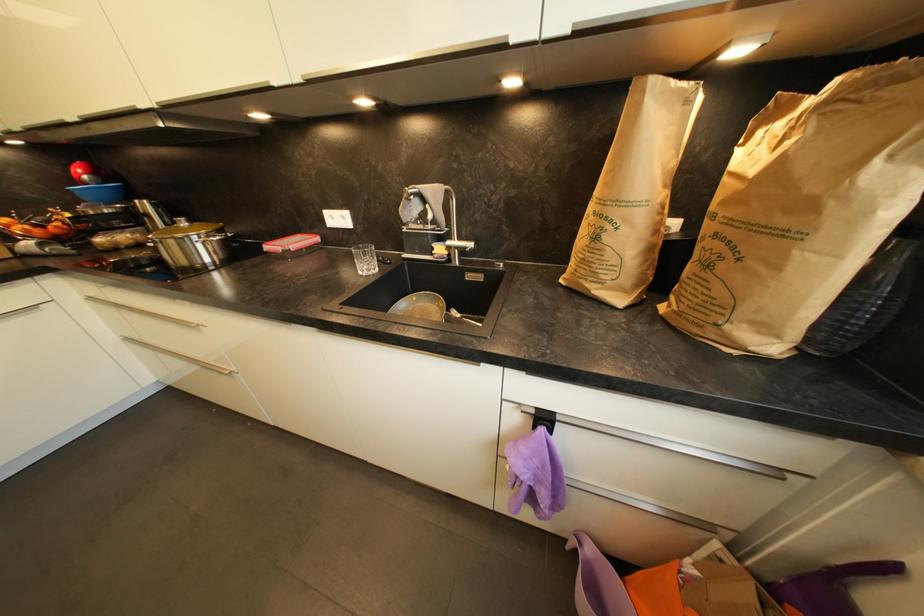
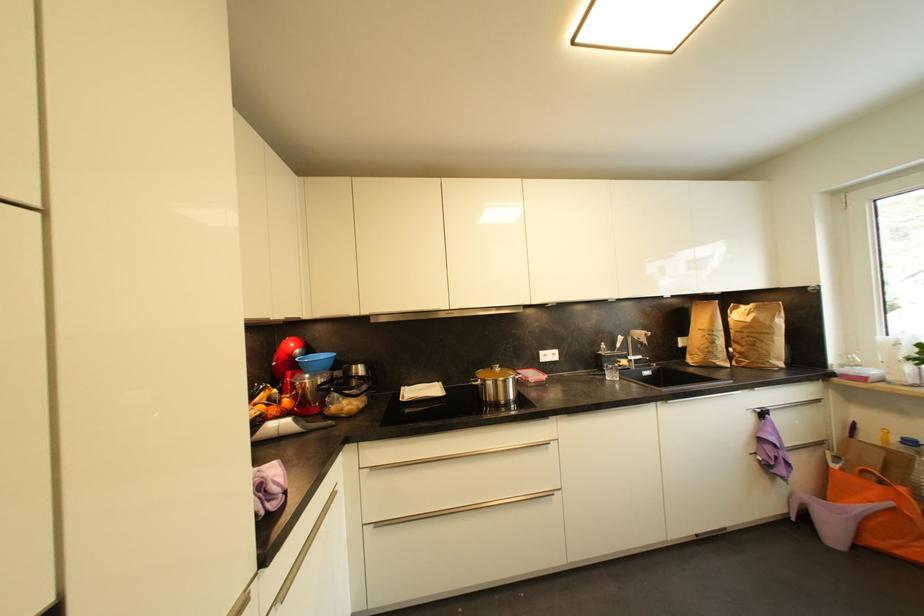
Locate, in the second image, the point that corresponds to pixel 188 225 in the first image.

(503, 371)